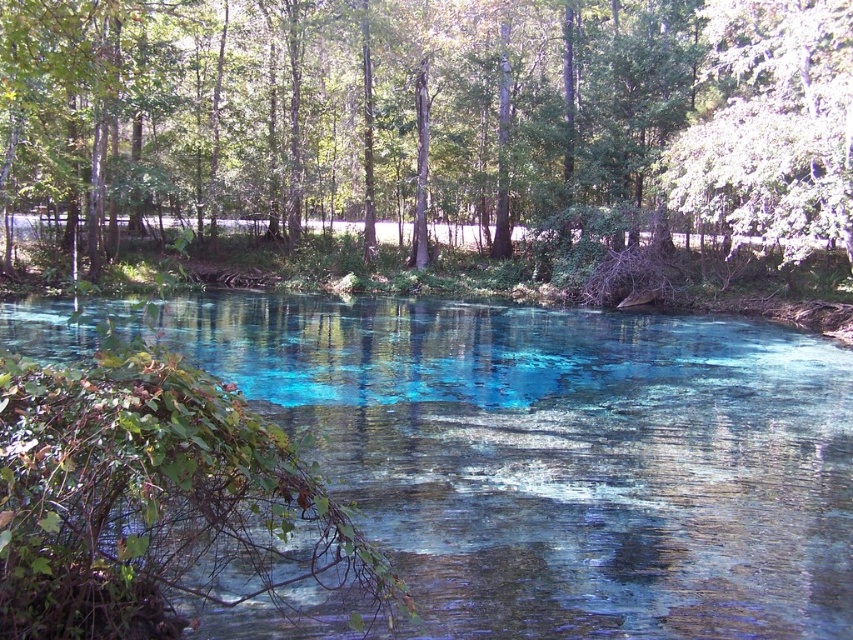
Question: Is translucent blue water at center closer to the viewer compared to white textured tree at upper right?

Choices:
 (A) yes
 (B) no

Answer: (A)

Question: Which is nearer to the green leafy tree at center?

Choices:
 (A) white textured tree at upper right
 (B) translucent blue water at center

Answer: (A)

Question: Is translucent blue water at center positioned at the back of green leafy tree at center?

Choices:
 (A) no
 (B) yes

Answer: (A)

Question: Which point is closer to the camera?

Choices:
 (A) green leafy tree at center
 (B) translucent blue water at center

Answer: (B)

Question: Is green leafy tree at center to the right of white textured tree at upper right from the viewer's perspective?

Choices:
 (A) yes
 (B) no

Answer: (B)

Question: Which object is the farthest from the translucent blue water at center?

Choices:
 (A) white textured tree at upper right
 (B) green leafy tree at center

Answer: (B)